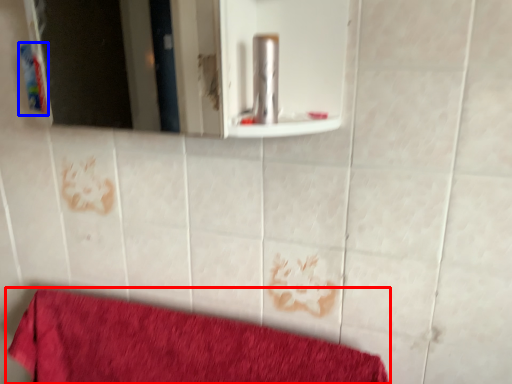
Question: Among these objects, which one is nearest to the camera, towel (highlighted by a red box) or toiletry (highlighted by a blue box)?

Choices:
 (A) towel
 (B) toiletry

Answer: (A)